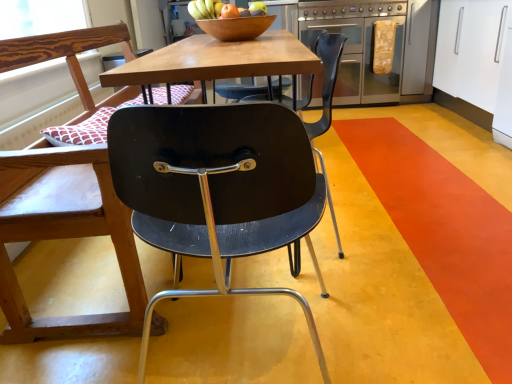
Question: Is shiny wooden bowl at upper center further to camera compared to matte black chair at left, which is counted as the 2th chair, starting from the right?

Choices:
 (A) no
 (B) yes

Answer: (B)

Question: Can you confirm if shiny wooden bowl at upper center is shorter than matte black chair at left, which appears as the first chair when viewed from the left?

Choices:
 (A) yes
 (B) no

Answer: (A)

Question: Is the surface of shiny wooden bowl at upper center in direct contact with matte black chair at left, which is counted as the 2th chair, starting from the right?

Choices:
 (A) yes
 (B) no

Answer: (B)

Question: Is shiny wooden bowl at upper center not near matte black chair at left, which is counted as the 2th chair, starting from the right?

Choices:
 (A) no
 (B) yes

Answer: (B)

Question: Considering the relative positions of shiny wooden bowl at upper center and matte black chair at left, which appears as the first chair when viewed from the left, in the image provided, is shiny wooden bowl at upper center to the right of matte black chair at left, which appears as the first chair when viewed from the left, from the viewer's perspective?

Choices:
 (A) yes
 (B) no

Answer: (A)

Question: From a real-world perspective, does shiny wooden bowl at upper center sit lower than matte black chair at left, which is counted as the 2th chair, starting from the right?

Choices:
 (A) yes
 (B) no

Answer: (B)

Question: Are wooden bowl at center and white glossy cabinet at upper right far apart?

Choices:
 (A) no
 (B) yes

Answer: (B)

Question: Can you confirm if wooden bowl at center is bigger than white glossy cabinet at upper right?

Choices:
 (A) yes
 (B) no

Answer: (B)

Question: Is wooden bowl at center completely or partially outside of white glossy cabinet at upper right?

Choices:
 (A) no
 (B) yes

Answer: (B)

Question: Is wooden bowl at center looking in the opposite direction of white glossy cabinet at upper right?

Choices:
 (A) no
 (B) yes

Answer: (A)

Question: From a real-world perspective, is wooden bowl at center beneath white glossy cabinet at upper right?

Choices:
 (A) yes
 (B) no

Answer: (B)

Question: From the image's perspective, is wooden bowl at center located above white glossy cabinet at upper right?

Choices:
 (A) no
 (B) yes

Answer: (A)

Question: Is matte black chair at center, the 2th chair from the left, surrounding white glossy cabinet at upper right?

Choices:
 (A) no
 (B) yes

Answer: (A)